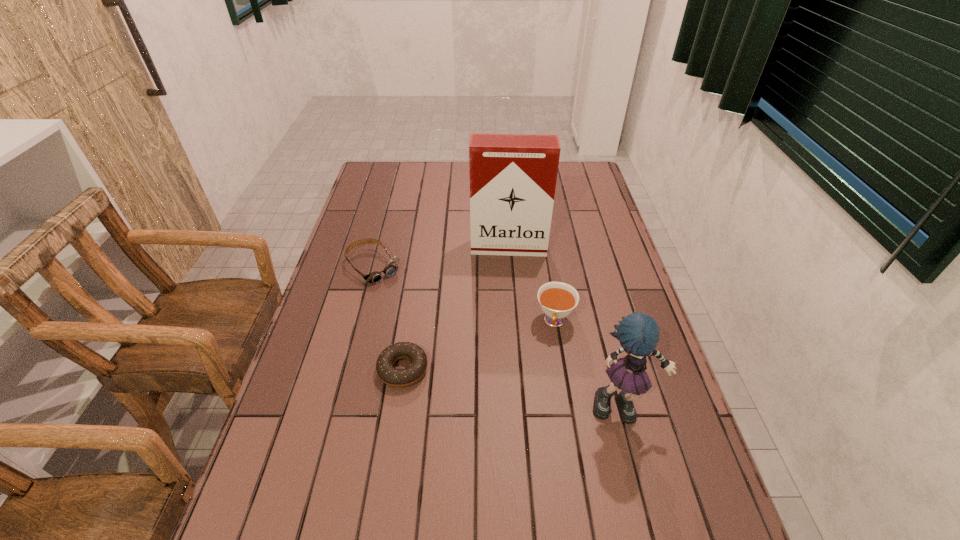
This screenshot has width=960, height=540. What are the coordinates of `blank region between the shortest object and the second tallest object` in the screenshot? It's located at (513, 388).

At what (x,y) coordinates should I click in order to perform the action: click on vacant space in between the rag doll and the doughnut. Please return your answer as a coordinate pair (x, y). Looking at the image, I should click on (513, 388).

Where is `vacant region between the goggles and the doughnut`? This screenshot has height=540, width=960. vacant region between the goggles and the doughnut is located at coordinates (389, 318).

You are a GUI agent. You are given a task and a screenshot of the screen. Output one action in this format:
    pyautogui.click(x=<x>, y=<y>)
    Task: Click on the free area in between the second shortest object and the second tallest object
    This screenshot has width=960, height=540.
    Given the screenshot: What is the action you would take?
    pyautogui.click(x=498, y=337)

This screenshot has height=540, width=960. What are the coordinates of `free space between the teacup and the tallest object` in the screenshot? It's located at (532, 285).

Identify which object is located as the second nearest to the fourth shortest object. Please provide its 2D coordinates. Your answer should be formatted as a tuple, i.e. [(x, y)], where the tuple contains the x and y coordinates of a point satisfying the conditions above.

[(398, 378)]

The image size is (960, 540). I want to click on object that is the third closest to the doughnut, so click(x=513, y=177).

Locate an element on the screen. Image resolution: width=960 pixels, height=540 pixels. free space in the image that satisfies the following two spatial constraints: 1. on the back side of the cigarette_case; 2. on the right side of the second shortest object is located at coordinates (379, 248).

You are a GUI agent. You are given a task and a screenshot of the screen. Output one action in this format:
    pyautogui.click(x=<x>, y=<y>)
    Task: Click on the free space in the image that satisfies the following two spatial constraints: 1. on the back side of the third tallest object; 2. on the left side of the shortest object
    
    Given the screenshot: What is the action you would take?
    pyautogui.click(x=410, y=321)